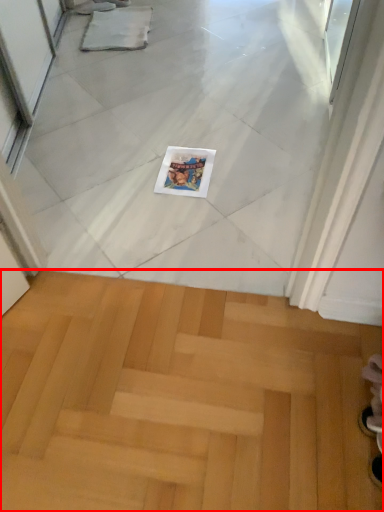
Question: From the image's perspective, what is the correct spatial relationship of stairwell (annotated by the red box) in relation to magazine?

Choices:
 (A) above
 (B) below

Answer: (B)